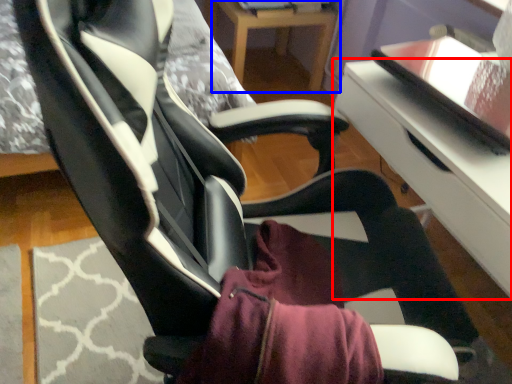
Question: Which object is closer to the camera taking this photo, table (highlighted by a red box) or table (highlighted by a blue box)?

Choices:
 (A) table
 (B) table

Answer: (A)